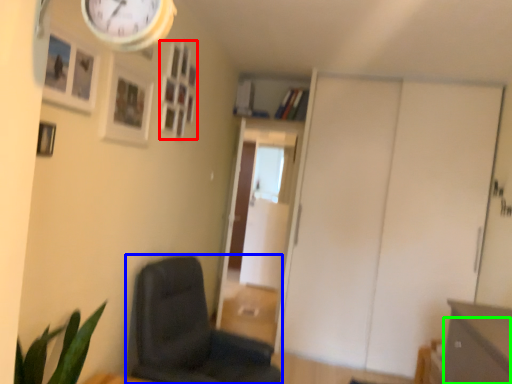
Question: Which object is positioned farthest from picture frame (highlighted by a red box)? Select from chair (highlighted by a blue box) and drawer (highlighted by a green box).

Choices:
 (A) chair
 (B) drawer

Answer: (B)